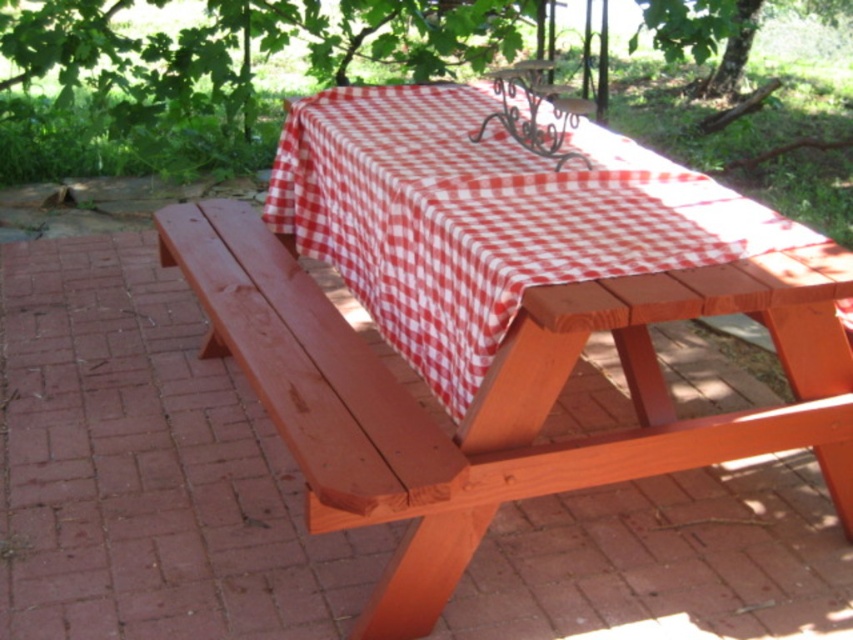
Between red checkered tablecloth at center and green leafy tree at upper center, which one is positioned lower?

Positioned lower is red checkered tablecloth at center.

Between red checkered tablecloth at center and green leafy tree at upper center, which one has more height?

Standing taller between the two is red checkered tablecloth at center.

Between point (502, 292) and point (700, 29), which one is positioned behind?

The point (700, 29) is more distant.

At what (x,y) coordinates should I click in order to perform the action: click on red checkered tablecloth at center. Please return your answer as a coordinate pair (x, y). Looking at the image, I should click on (485, 218).

From the picture: Who is taller, smooth wood bench at left or green leafy tree at upper center?

Standing taller between the two is smooth wood bench at left.

Can you confirm if smooth wood bench at left is positioned to the left of green leafy tree at upper center?

Indeed, smooth wood bench at left is positioned on the left side of green leafy tree at upper center.

The height and width of the screenshot is (640, 853). In order to click on smooth wood bench at left in this screenshot , I will do `click(310, 372)`.

This screenshot has height=640, width=853. Find the location of `smooth wood bench at left`. smooth wood bench at left is located at coordinates (310, 372).

Can you confirm if red checkered tablecloth at center is positioned to the left of smooth wood bench at left?

In fact, red checkered tablecloth at center is to the right of smooth wood bench at left.

Between red checkered tablecloth at center and smooth wood bench at left, which one appears on the right side from the viewer's perspective?

Positioned to the right is red checkered tablecloth at center.

Between point (680, 205) and point (370, 371), which one is positioned in front?

Point (370, 371) is more forward.

The image size is (853, 640). I want to click on red checkered tablecloth at center, so click(485, 218).